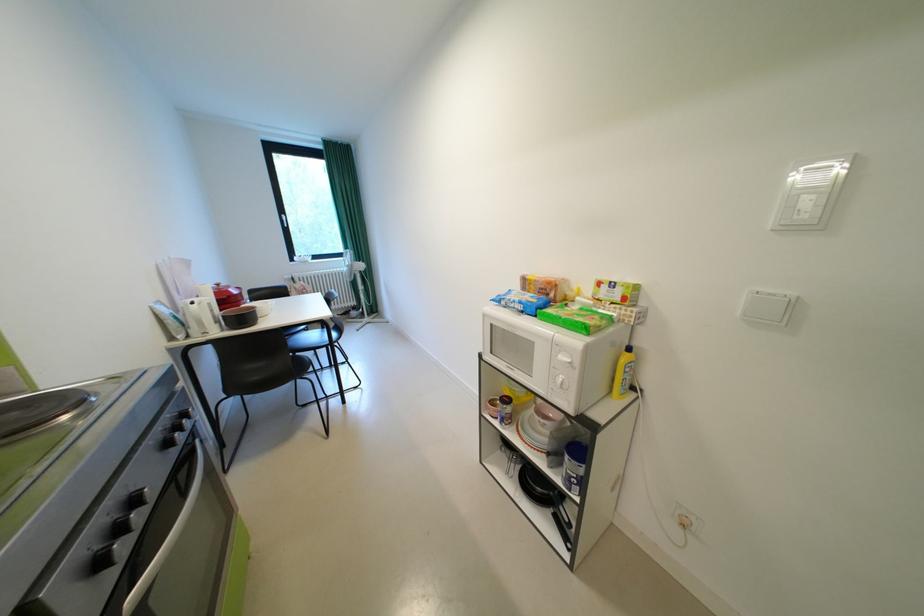
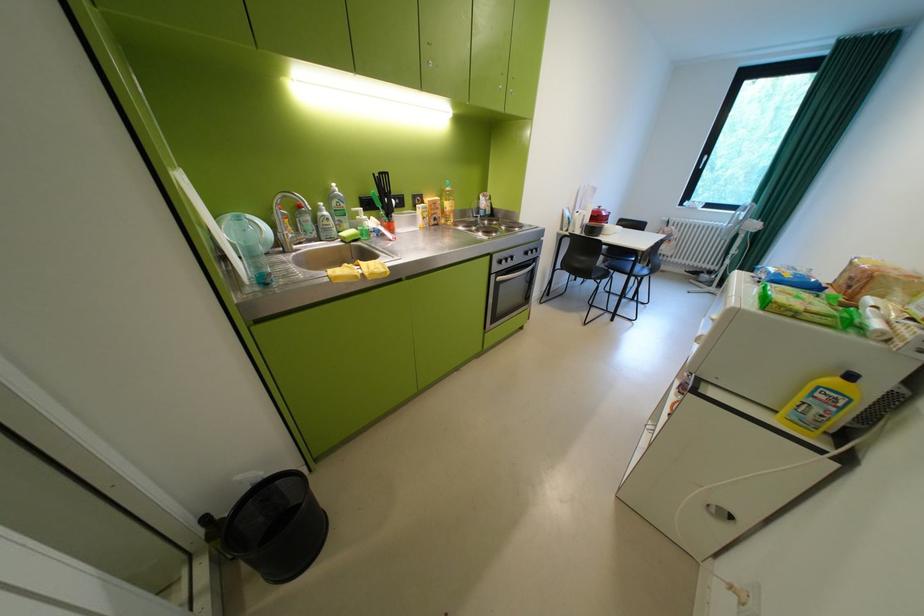
Locate, in the second image, the point that corresponds to (x=176, y=446) in the first image.

(537, 254)